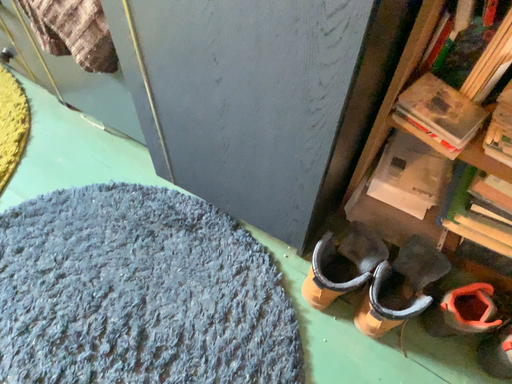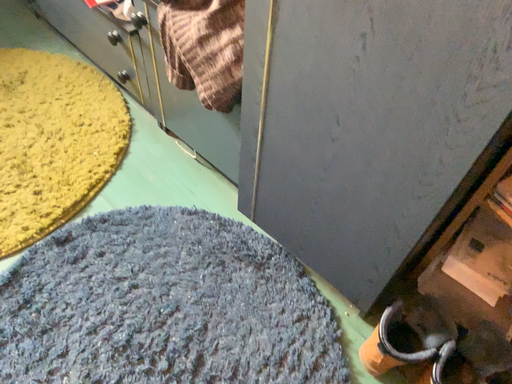
Question: Which way did the camera rotate in the video?

Choices:
 (A) rotated downward
 (B) rotated upward

Answer: (B)